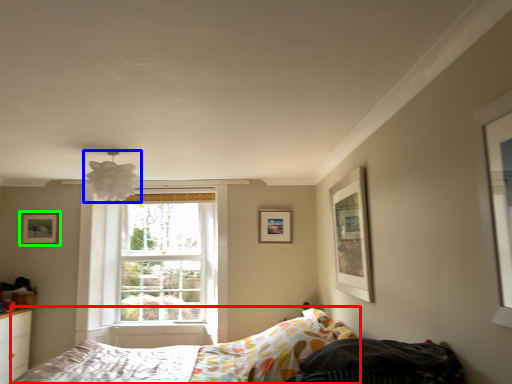
Question: Which object is the farthest from bed (highlighted by a red box)? Choose among these: lamp (highlighted by a blue box) or picture frame (highlighted by a green box).

Choices:
 (A) lamp
 (B) picture frame

Answer: (B)